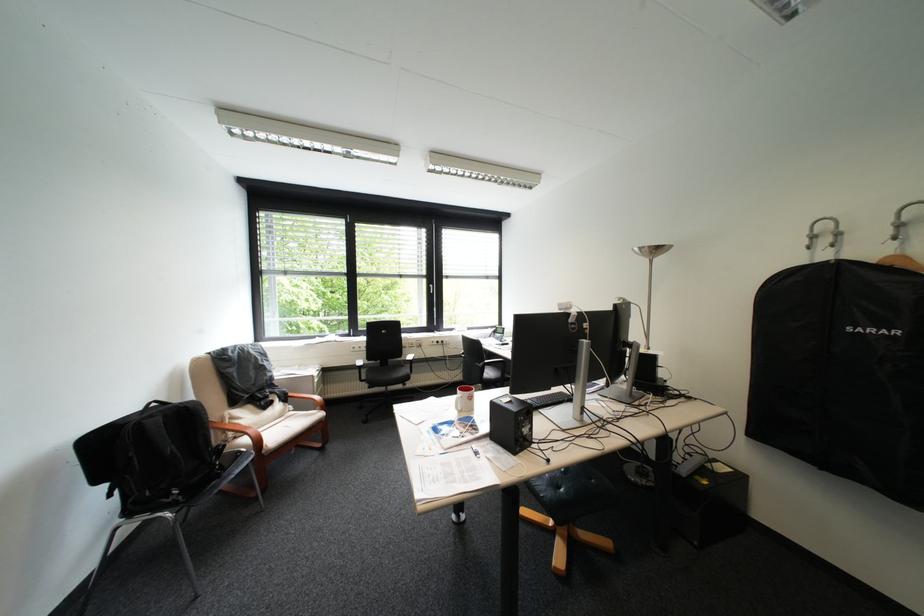
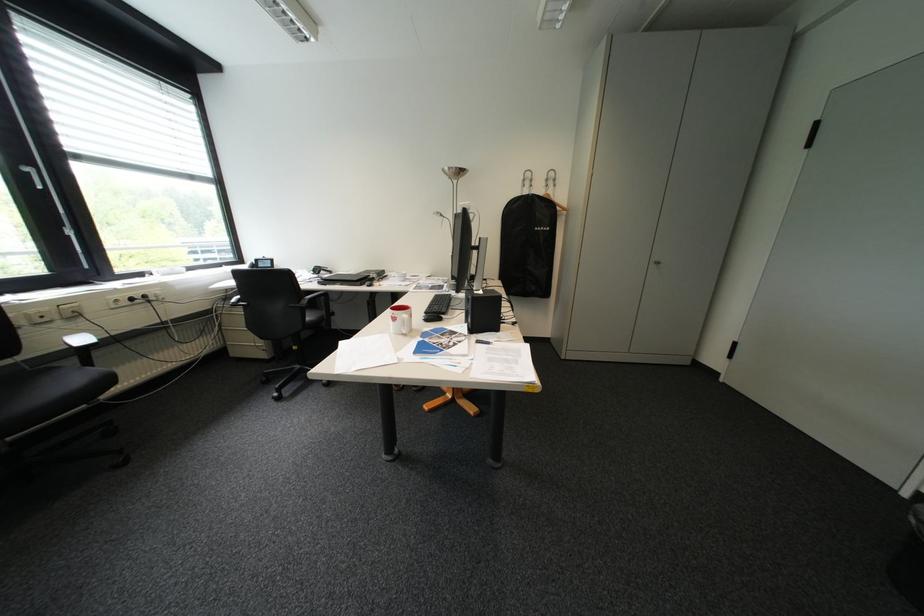
The point at (418, 365) is marked in the first image. Where is the corresponding point in the second image?

(59, 367)